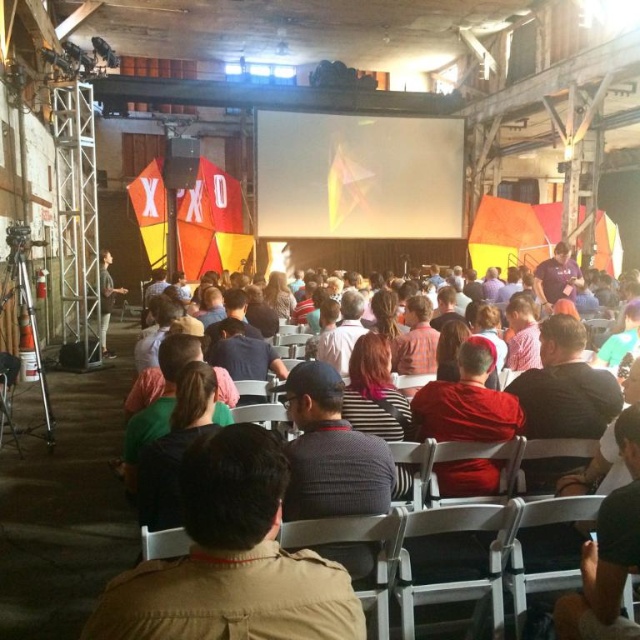
You are a photographer at the event and want to capture a photo of both the striped shirt at center and the matte black speaker at upper center. Which object is positioned closer to the camera?

The striped shirt at center is closer to the viewer than the matte black speaker at upper center, so the striped shirt at center would be closer to the camera.

You are an event planner trying to arrange a photo shoot. You need to position a camera to capture both the red matte shirt at center and the striped shirt at center in the same frame. Based on their positions, which shirt should be placed to the left to ensure both are visible?

The striped shirt at center should be placed to the left because the red matte shirt at center is currently to the right of it, so positioning the striped shirt at center on the left would keep them in order and ensure both are visible in the frame.